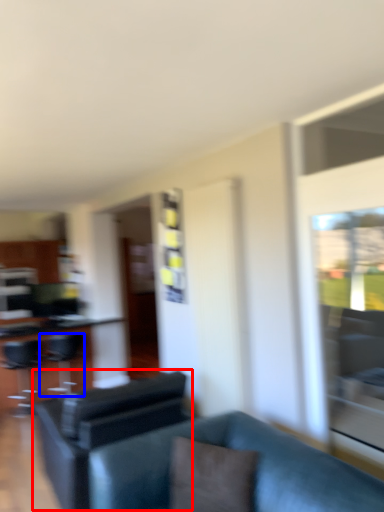
Question: Which object is further to the camera taking this photo, swivel chair (highlighted by a red box) or swivel chair (highlighted by a blue box)?

Choices:
 (A) swivel chair
 (B) swivel chair

Answer: (B)